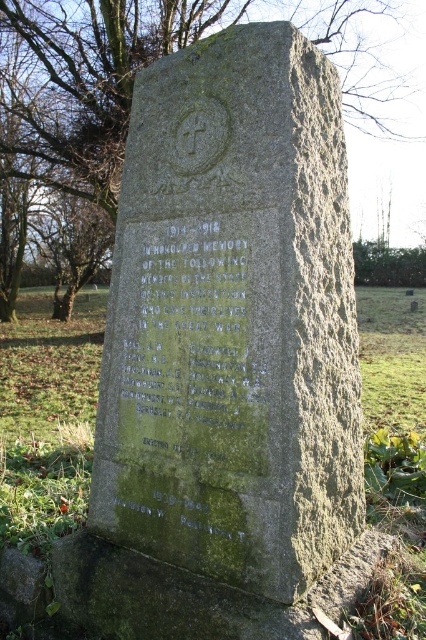
How distant is green mossy stone at center from green mossy stone at upper left?

green mossy stone at center is 8.59 meters away from green mossy stone at upper left.

The height and width of the screenshot is (640, 426). Describe the element at coordinates (48, 417) in the screenshot. I see `green mossy stone at center` at that location.

Which is behind, point (380, 316) or point (81, 38)?

The point (380, 316) is behind.

You are a GUI agent. You are given a task and a screenshot of the screen. Output one action in this format:
    pyautogui.click(x=<x>, y=<y>)
    Task: Click on the green mossy stone at center
    
    Given the screenshot: What is the action you would take?
    pyautogui.click(x=48, y=417)

Can you confirm if green stone gravestone at center is taller than green mossy stone at center?

In fact, green stone gravestone at center may be shorter than green mossy stone at center.

Does point (178, 252) lie in front of point (412, 344)?

That is True.

This screenshot has height=640, width=426. In order to click on green stone gravestone at center in this screenshot , I will do `click(233, 321)`.

Does point (115, 339) come farther from viewer compared to point (348, 80)?

No, it is in front of (348, 80).

The image size is (426, 640). I want to click on green stone gravestone at center, so click(x=233, y=321).

Between point (296, 221) and point (108, 72), which one is positioned behind?

The point (108, 72) is behind.

This screenshot has width=426, height=640. In order to click on green stone gravestone at center in this screenshot , I will do `click(233, 321)`.